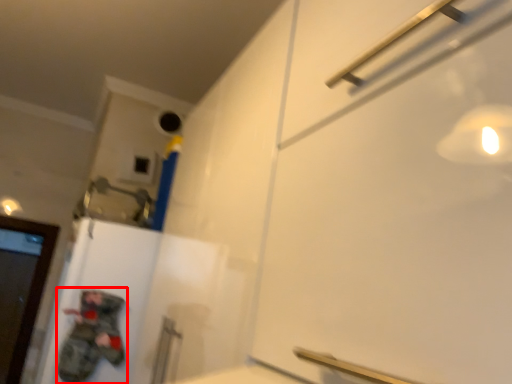
Question: Where is person (annotated by the red box) located in relation to door in the image?

Choices:
 (A) left
 (B) right

Answer: (B)